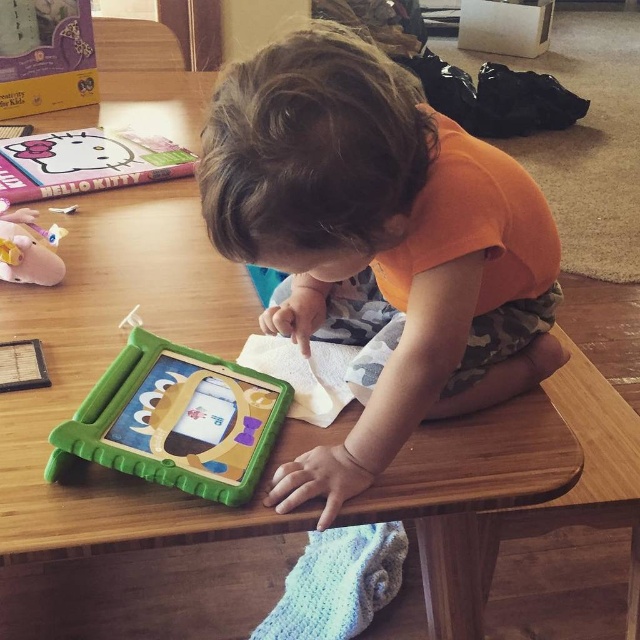
Question: Estimate the real-world distances between objects in this image. Which object is farther from the orange cotton toddler at center?

Choices:
 (A) pink rubber piggy bank at left
 (B) green plastic tablet at center

Answer: (A)

Question: Is green plastic tablet at center wider than pink rubber piggy bank at left?

Choices:
 (A) no
 (B) yes

Answer: (B)

Question: Among these objects, which one is nearest to the camera?

Choices:
 (A) green plastic tablet at center
 (B) orange cotton toddler at center
 (C) pink rubber piggy bank at left

Answer: (B)

Question: Does orange cotton toddler at center have a smaller size compared to pink rubber piggy bank at left?

Choices:
 (A) no
 (B) yes

Answer: (A)

Question: Based on their relative distances, which object is farther from the orange cotton toddler at center?

Choices:
 (A) green plastic tablet at center
 (B) pink rubber piggy bank at left

Answer: (B)

Question: Is orange cotton toddler at center smaller than green plastic tablet at center?

Choices:
 (A) no
 (B) yes

Answer: (A)